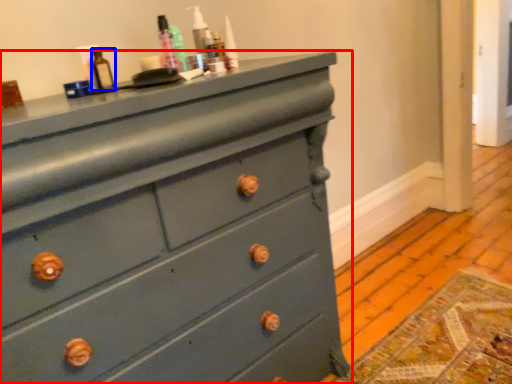
Question: Which of the following is the closest to the observer, chest of drawers (highlighted by a red box) or bottle (highlighted by a blue box)?

Choices:
 (A) chest of drawers
 (B) bottle

Answer: (A)